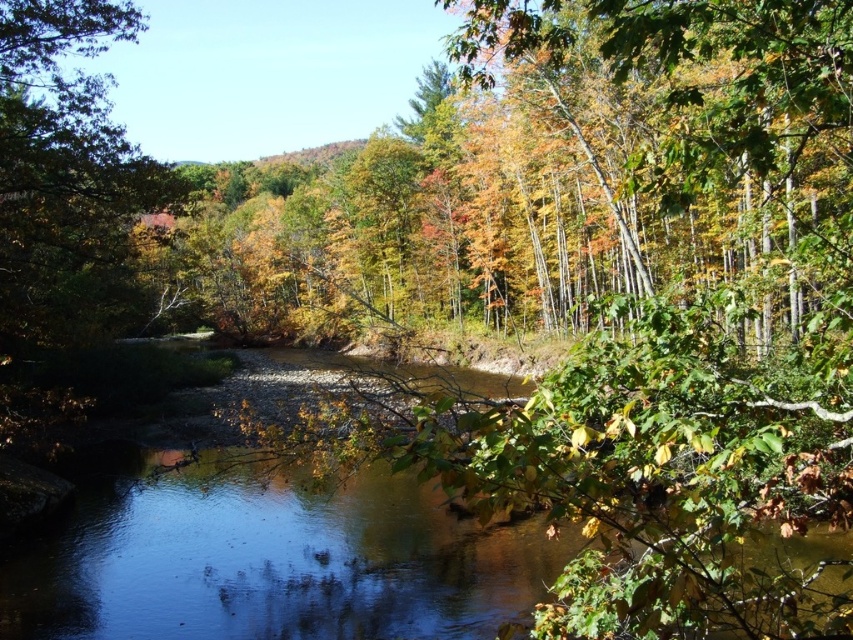
In the scene shown: Is clear water at center positioned in front of green leafy tree at left?

Yes, clear water at center is in front of green leafy tree at left.

The height and width of the screenshot is (640, 853). Describe the element at coordinates (273, 566) in the screenshot. I see `clear water at center` at that location.

You are a GUI agent. You are given a task and a screenshot of the screen. Output one action in this format:
    pyautogui.click(x=<x>, y=<y>)
    Task: Click on the clear water at center
    The image size is (853, 640).
    Given the screenshot: What is the action you would take?
    pyautogui.click(x=273, y=566)